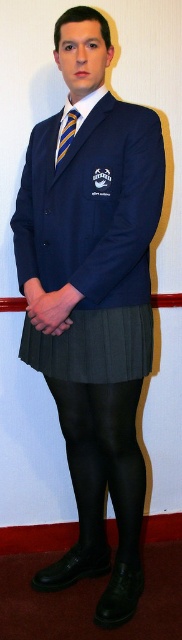
Is dark grey pleated skirt at center to the left of striped fabric tie at center from the viewer's perspective?

In fact, dark grey pleated skirt at center is to the right of striped fabric tie at center.

Between dark grey pleated skirt at center and striped fabric tie at center, which one has more height?

dark grey pleated skirt at center

Image resolution: width=182 pixels, height=640 pixels. Describe the element at coordinates (93, 346) in the screenshot. I see `dark grey pleated skirt at center` at that location.

Where is `dark grey pleated skirt at center`? This screenshot has width=182, height=640. dark grey pleated skirt at center is located at coordinates pos(93,346).

Is point (131, 492) positioned after point (123, 330)?

Yes, it is behind point (123, 330).

Does black tights at lower center appear on the left side of dark grey pleated skirt at center?

In fact, black tights at lower center is to the right of dark grey pleated skirt at center.

This screenshot has height=640, width=182. Describe the element at coordinates (103, 458) in the screenshot. I see `black tights at lower center` at that location.

The image size is (182, 640). What are the coordinates of `black tights at lower center` in the screenshot? It's located at (103, 458).

Does point (137, 388) come closer to viewer compared to point (60, 145)?

No.

Image resolution: width=182 pixels, height=640 pixels. Describe the element at coordinates (103, 458) in the screenshot. I see `black tights at lower center` at that location.

Identify the location of black tights at lower center. pos(103,458).